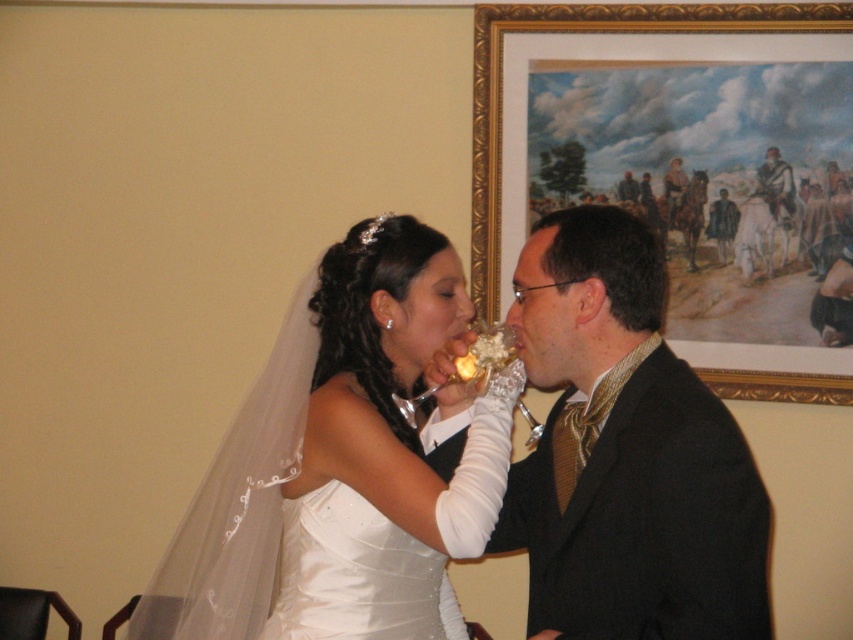
Can you confirm if shiny gold tie at center is wider than white satin dress at center?

Yes, shiny gold tie at center is wider than white satin dress at center.

Who is more distant from viewer, (570, 394) or (494, 426)?

The point (570, 394) is behind.

Is point (575, 397) closer to camera compared to point (424, 353)?

Yes, point (575, 397) is in front of point (424, 353).

Find the location of `shiny gold tie at center`. shiny gold tie at center is located at coordinates (625, 452).

Which of these two, white satin dress at center or gold-framed painting at upper right, stands taller?

gold-framed painting at upper right

Is point (294, 544) in front of point (827, 376)?

Yes, point (294, 544) is closer to viewer.

Identify the location of white satin dress at center. (383, 449).

Does shiny gold tie at center have a greater height compared to gold-framed painting at upper right?

In fact, shiny gold tie at center may be shorter than gold-framed painting at upper right.

Consider the image. Does shiny gold tie at center appear under gold-framed painting at upper right?

Indeed, shiny gold tie at center is positioned under gold-framed painting at upper right.

Where is `shiny gold tie at center`? Image resolution: width=853 pixels, height=640 pixels. shiny gold tie at center is located at coordinates (625, 452).